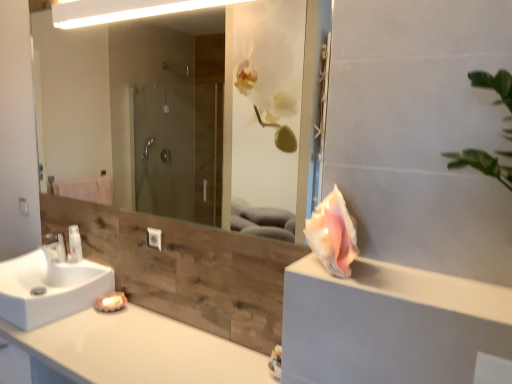
Question: Can you confirm if white glossy countertop at lower left is positioned to the left of white glossy faucet at lower left?

Choices:
 (A) yes
 (B) no

Answer: (B)

Question: Is white glossy countertop at lower left taller than white glossy faucet at lower left?

Choices:
 (A) no
 (B) yes

Answer: (B)

Question: Can you confirm if white glossy countertop at lower left is positioned to the right of white glossy faucet at lower left?

Choices:
 (A) yes
 (B) no

Answer: (A)

Question: Considering the relative sizes of white glossy countertop at lower left and white glossy faucet at lower left in the image provided, is white glossy countertop at lower left wider than white glossy faucet at lower left?

Choices:
 (A) no
 (B) yes

Answer: (B)

Question: Is white glossy countertop at lower left bigger than white glossy faucet at lower left?

Choices:
 (A) yes
 (B) no

Answer: (A)

Question: Considering their positions, is pink shell at right located in front of or behind white glossy bottle at left?

Choices:
 (A) behind
 (B) front

Answer: (B)

Question: From a real-world perspective, is pink shell at right above or below white glossy bottle at left?

Choices:
 (A) above
 (B) below

Answer: (A)

Question: In the image, is pink shell at right on the left side or the right side of white glossy bottle at left?

Choices:
 (A) left
 (B) right

Answer: (B)

Question: Is point (440, 377) positioned closer to the camera than point (73, 248)?

Choices:
 (A) farther
 (B) closer

Answer: (B)

Question: In terms of height, does transparent glass mirror at upper center look taller or shorter compared to white glossy sink at lower left?

Choices:
 (A) tall
 (B) short

Answer: (A)

Question: Does point (157, 140) appear closer or farther from the camera than point (27, 269)?

Choices:
 (A) farther
 (B) closer

Answer: (A)

Question: From a real-world perspective, is transparent glass mirror at upper center physically located above or below white glossy sink at lower left?

Choices:
 (A) above
 (B) below

Answer: (A)

Question: Considering their positions, is transparent glass mirror at upper center located in front of or behind white glossy sink at lower left?

Choices:
 (A) behind
 (B) front

Answer: (B)

Question: Is pink shell at right situated inside pink shell at right or outside?

Choices:
 (A) outside
 (B) inside

Answer: (A)

Question: Is pink shell at right taller or shorter than pink shell at right?

Choices:
 (A) tall
 (B) short

Answer: (A)